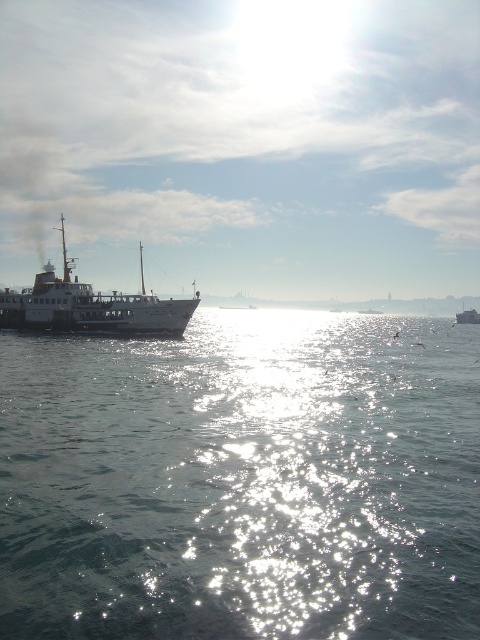
Question: Among these objects, which one is farthest from the camera?

Choices:
 (A) metallic gray ferry at right
 (B) metallic gray ferry at left

Answer: (A)

Question: Which point is closer to the camera taking this photo?

Choices:
 (A) (91, 524)
 (B) (191, 298)

Answer: (A)

Question: Which object appears closest to the camera in this image?

Choices:
 (A) metallic gray ferry at right
 (B) glistening water at center
 (C) metallic gray ferry at left

Answer: (B)

Question: Is glistening water at center wider than metallic gray ferry at right?

Choices:
 (A) yes
 (B) no

Answer: (B)

Question: Is glistening water at center positioned before metallic gray ferry at left?

Choices:
 (A) no
 (B) yes

Answer: (B)

Question: From the image, what is the correct spatial relationship of metallic gray ferry at left in relation to metallic gray ferry at right?

Choices:
 (A) below
 (B) above

Answer: (A)